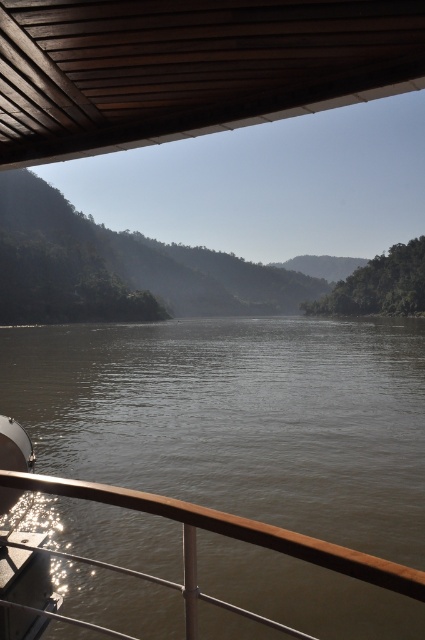
Question: Does brown wooden deck at upper center appear under metal/rustic rail at lower left?

Choices:
 (A) yes
 (B) no

Answer: (B)

Question: Which of the following is the closest to the observer?

Choices:
 (A) (153, 1)
 (B) (204, 515)

Answer: (B)

Question: Does brown wooden deck at upper center have a lesser width compared to metal/rustic rail at lower left?

Choices:
 (A) no
 (B) yes

Answer: (A)

Question: From the image, what is the correct spatial relationship of brown wooden deck at upper center in relation to metal/rustic rail at lower left?

Choices:
 (A) below
 (B) above

Answer: (B)